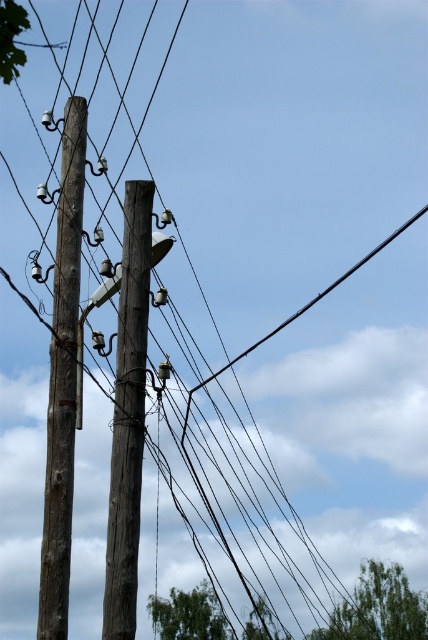
Is wooden telegraph pole at left to the right of brown wooden telegraph pole at center from the viewer's perspective?

In fact, wooden telegraph pole at left is to the left of brown wooden telegraph pole at center.

This screenshot has height=640, width=428. Identify the location of wooden telegraph pole at left. (x=62, y=380).